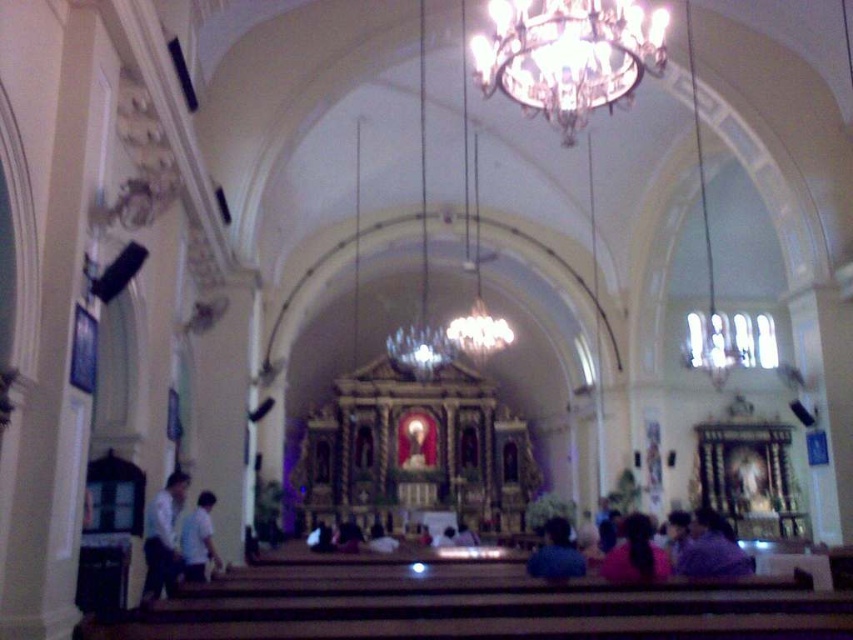
Does light blue shirt at lower left have a smaller size compared to white matte shirt at lower left?

Yes.

Which is behind, point (151, 570) or point (190, 518)?

Point (190, 518)

Which is in front, point (173, 515) or point (198, 576)?

Point (173, 515)

Locate an element on the screen. The image size is (853, 640). light blue shirt at lower left is located at coordinates (163, 538).

Between crystal glass chandelier at upper center and dark purple fabric at center, which one appears on the right side from the viewer's perspective?

dark purple fabric at center

Locate an element on the screen. crystal glass chandelier at upper center is located at coordinates click(567, 54).

Find the location of a particular element. This screenshot has width=853, height=640. crystal glass chandelier at upper center is located at coordinates (567, 54).

Is dark purple fabric at center wider than white matte shirt at lower left?

Indeed, dark purple fabric at center has a greater width compared to white matte shirt at lower left.

Can you confirm if dark purple fabric at center is bigger than white matte shirt at lower left?

Yes.

Does point (610, 557) come behind point (200, 518)?

No.

Find the location of a particular element. This screenshot has height=640, width=853. dark purple fabric at center is located at coordinates (635, 554).